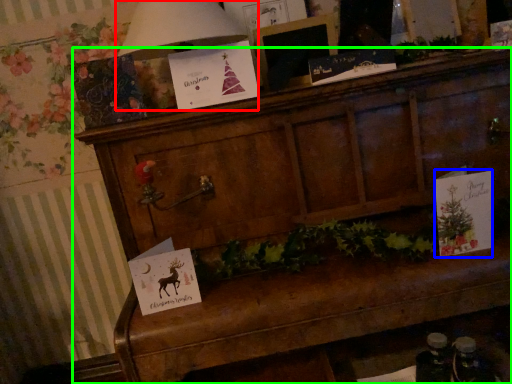
Question: Considering the real-world distances, which object is farthest from lamp (highlighted by a red box)? christmas card (highlighted by a blue box) or furniture (highlighted by a green box)?

Choices:
 (A) christmas card
 (B) furniture

Answer: (A)